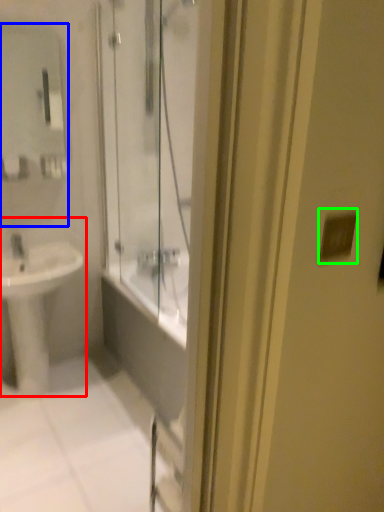
Question: Based on their relative distances, which object is nearer to sink (highlighted by a red box)? Choose from mirror (highlighted by a blue box) and light switch (highlighted by a green box).

Choices:
 (A) mirror
 (B) light switch

Answer: (A)